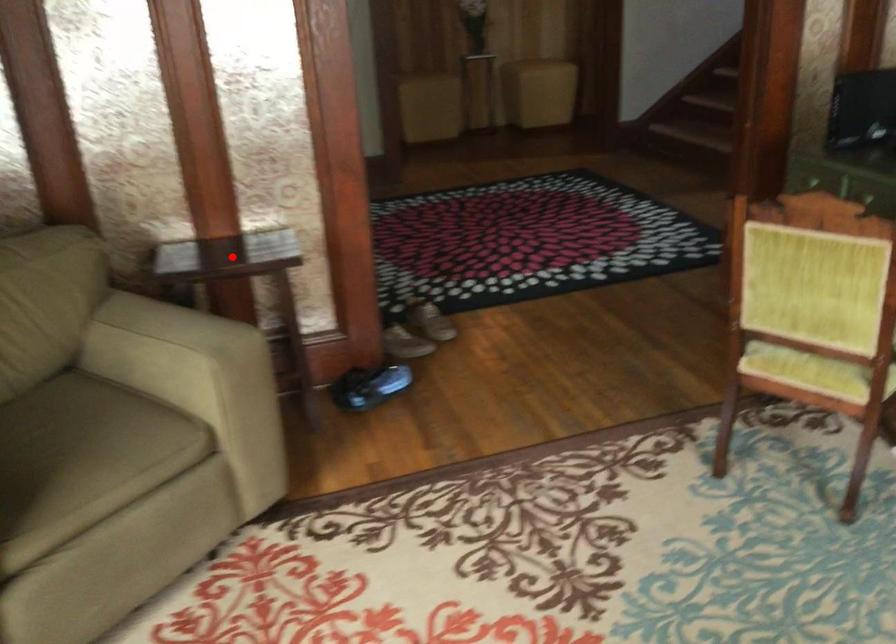
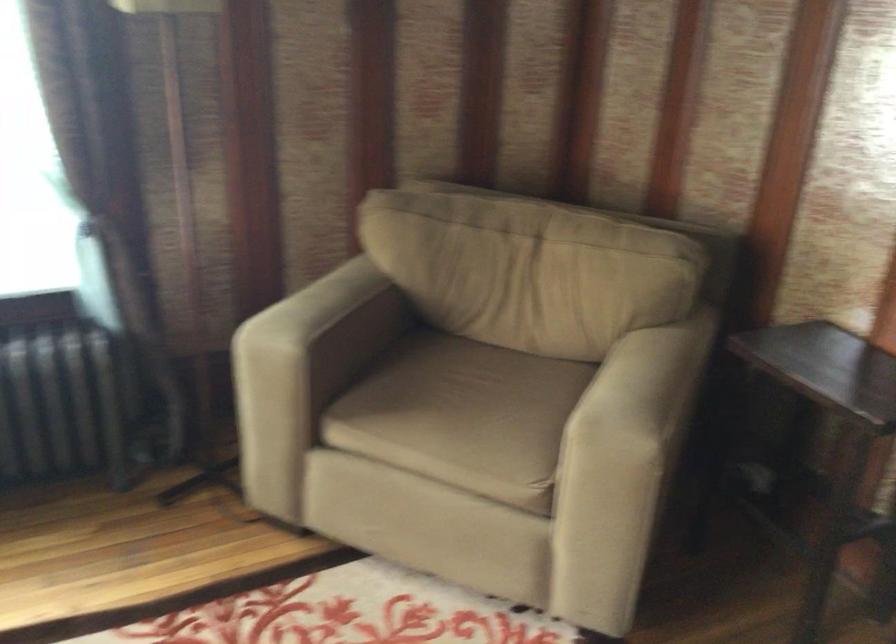
Question: A red point is marked in image1. In image2, is the corresponding 3D point closer to the camera or farther? Reply with the corresponding letter.

Choices:
 (A) The corresponding 3D point is closer.
 (B) The corresponding 3D point is farther.

Answer: (A)